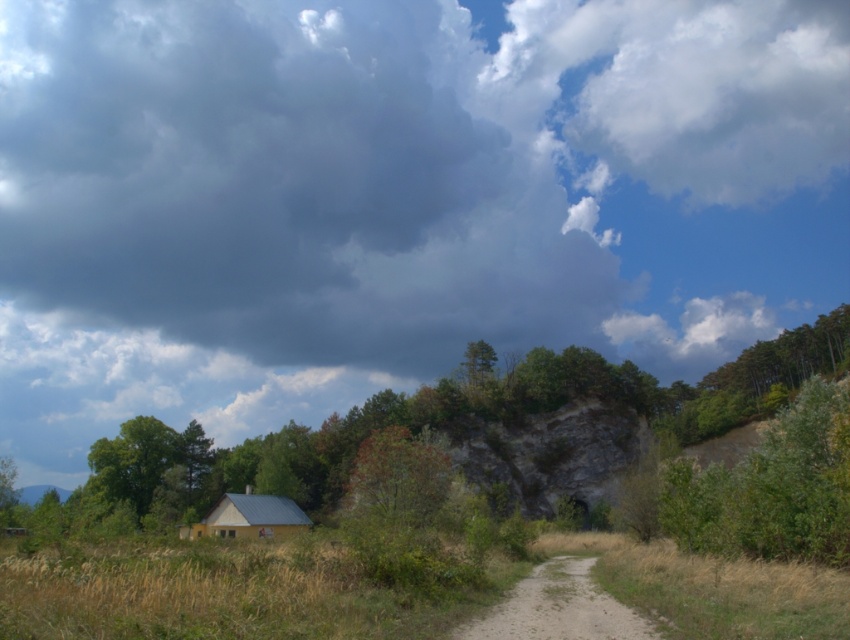
Question: Is reddish-brown bark tree at center below green leafy tree at lower left?

Choices:
 (A) yes
 (B) no

Answer: (B)

Question: Which object is positioned farthest from the dirt/gravel path at center?

Choices:
 (A) green matte tree at lower left
 (B) green leafy tree at center

Answer: (A)

Question: Which of the following is the closest to the observer?

Choices:
 (A) (246, 516)
 (B) (525, 634)
 (C) (411, 486)

Answer: (B)

Question: Among these points, which one is nearest to the camera?

Choices:
 (A) (465, 348)
 (B) (800, 548)
 (C) (9, 493)

Answer: (B)

Question: Observing the image, what is the correct spatial positioning of reddish-brown bark tree at center in reference to green leafy tree at upper center?

Choices:
 (A) above
 (B) below

Answer: (B)

Question: Can you confirm if green leafy tree at center is wider than green leafy tree at upper center?

Choices:
 (A) yes
 (B) no

Answer: (A)